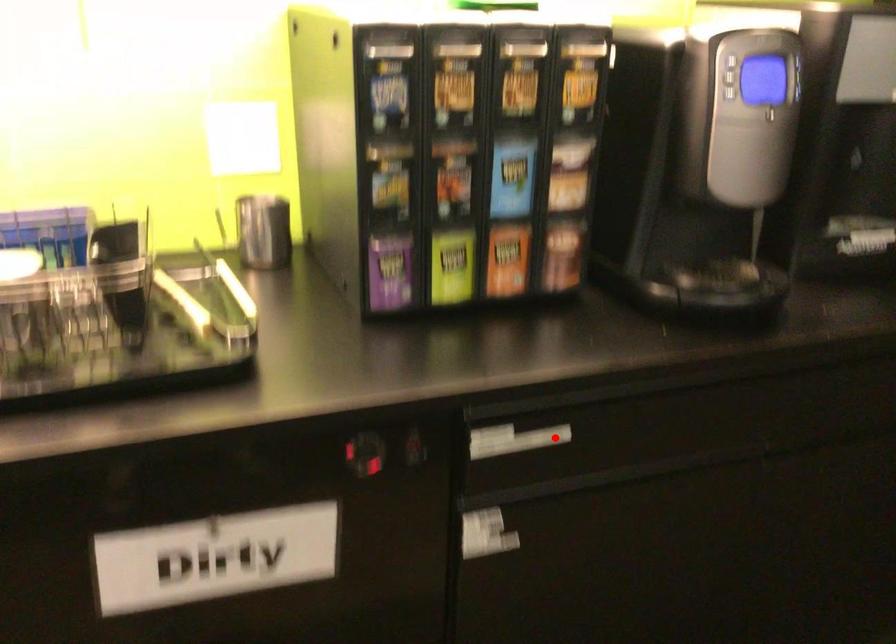
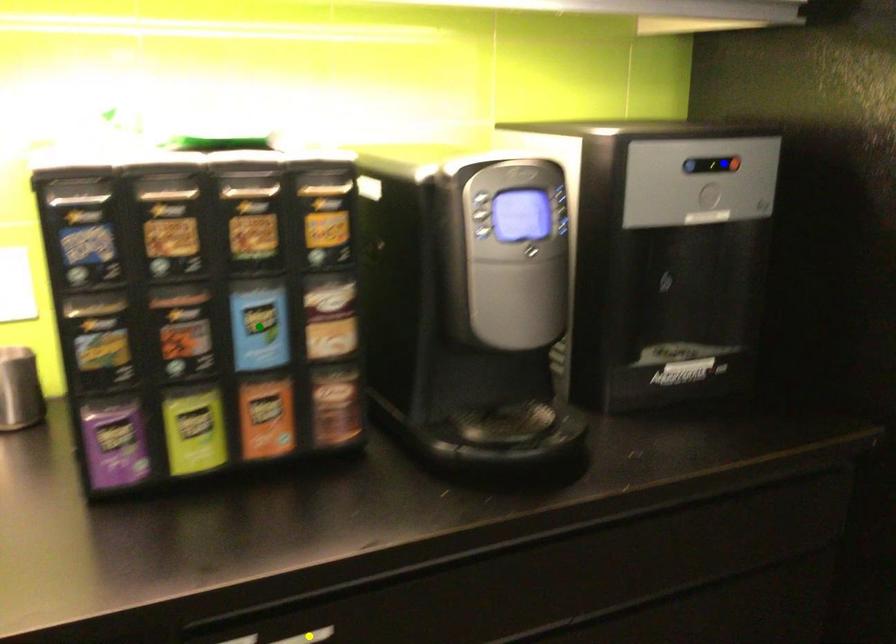
Question: I am providing you with two images of the same scene from different viewpoints. A red point is marked on the first image. You are given multiple points on the second image. Can you choose the point in image 2 that corresponds to the point in image 1?

Choices:
 (A) blue point
 (B) yellow point
 (C) green point

Answer: (B)